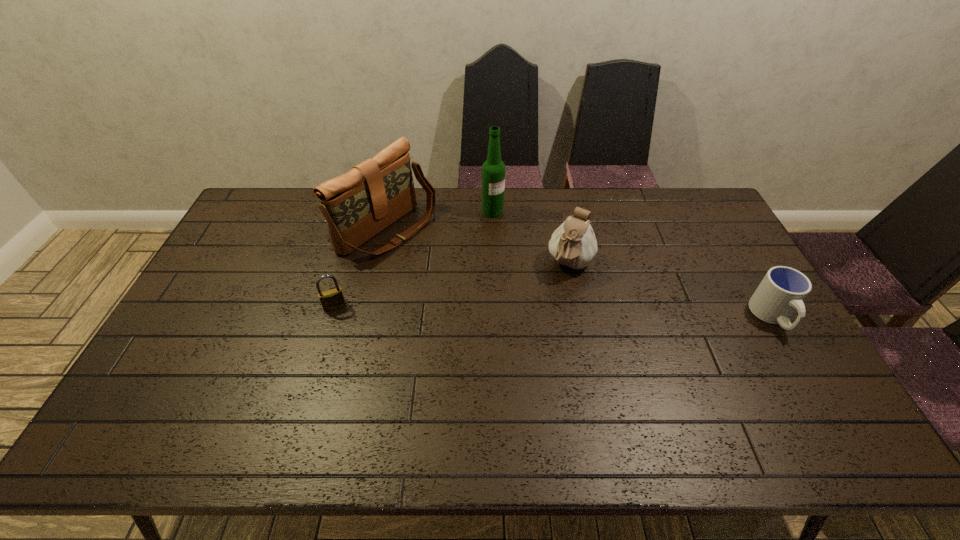
Locate an element on the screen. The image size is (960, 540). padlock is located at coordinates click(x=333, y=299).

Identify the location of the rightmost object. (782, 291).

In order to click on shoulder bag in this screenshot , I will do `click(357, 205)`.

What are the coordinates of `pouch` in the screenshot? It's located at (573, 244).

Find the location of a particular element. The image size is (960, 540). the fourth object from left to right is located at coordinates (573, 244).

Locate an element on the screen. The height and width of the screenshot is (540, 960). the tallest object is located at coordinates (493, 169).

What are the coordinates of `the third object from left to right` in the screenshot? It's located at (493, 169).

This screenshot has width=960, height=540. In order to click on vacant region located 0.130m on the back of the padlock in this screenshot , I will do `click(346, 271)`.

Find the location of `vacant space located with the handle on the side of the cup`. vacant space located with the handle on the side of the cup is located at coordinates (807, 377).

The height and width of the screenshot is (540, 960). In order to click on vacant space located 0.160m on the front-facing side of the fourth shortest object in this screenshot , I will do `click(459, 273)`.